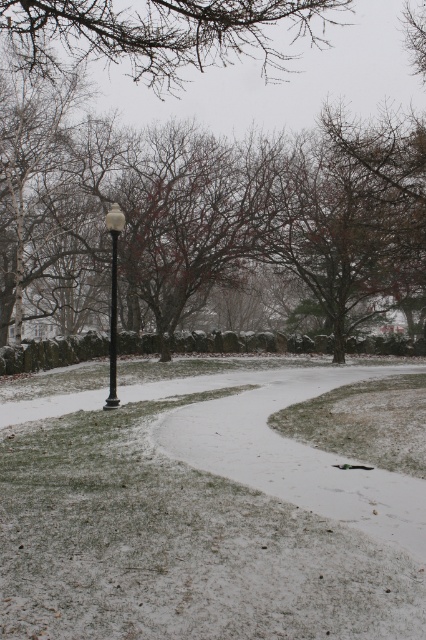
You are a bird flying over the winter scene and want to land on the closest object between the brown textured branches at upper center and the white glossy lamp post at center. Which object should you choose?

The brown textured branches at upper center are 14.41 meters away from the white glossy lamp post at center. Since you are flying over the scene, the closest object would depend on your current position. However, without specific information about your location, it is impossible to determine which object is closer.

You are an observer looking at the winter scene. You notice the brown textured branches at upper center and the white glossy lamp post at center. Which object appears closer to you?

The brown textured branches at upper center appears closer because it is in front of the white glossy lamp post at center.

You are standing on the winding path in the winter scene and want to walk from point A to point B. Point A is at coordinates point (155, 433) and point B is at coordinates point (120, 44). Which point is closer to you as you start walking?

Point A at coordinates point (155, 433) is closer to you because it is further to the viewer than point B at coordinates point (120, 44).